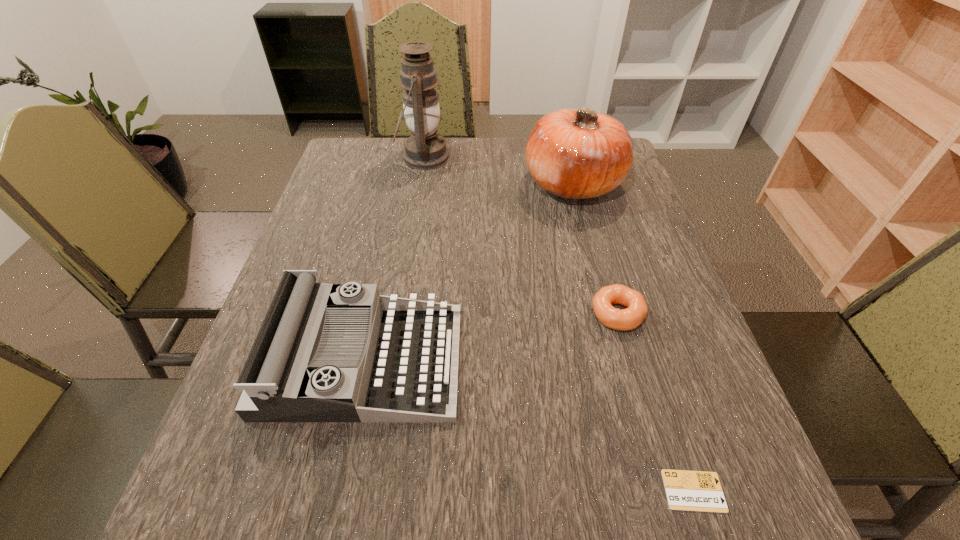
The width and height of the screenshot is (960, 540). What are the coordinates of `vacant region at the far edge of the desktop` in the screenshot? It's located at (475, 160).

Where is `free spot at the near edge of the desktop`? The width and height of the screenshot is (960, 540). free spot at the near edge of the desktop is located at coordinates (337, 502).

Where is `vacant area at the left edge of the desktop`? This screenshot has width=960, height=540. vacant area at the left edge of the desktop is located at coordinates (287, 457).

In the image, there is a desktop. Where is `free space at the right edge`? free space at the right edge is located at coordinates pyautogui.click(x=612, y=234).

Where is `free point between the identity card and the fourth shortest object`? The width and height of the screenshot is (960, 540). free point between the identity card and the fourth shortest object is located at coordinates (634, 338).

Find the location of a particular element. The image size is (960, 540). vacant area that lies between the shortest object and the oil lamp is located at coordinates (559, 324).

What are the coordinates of `free space between the shortest object and the doughnut` in the screenshot? It's located at (656, 402).

At what (x,y) coordinates should I click in order to perform the action: click on free space that is in between the oil lamp and the typewriter. Please return your answer as a coordinate pair (x, y). Looking at the image, I should click on (394, 259).

This screenshot has height=540, width=960. I want to click on unoccupied area between the pumpkin and the tallest object, so click(498, 171).

The image size is (960, 540). What are the coordinates of `unoccupied position between the typewriter and the doughnut` in the screenshot? It's located at (491, 338).